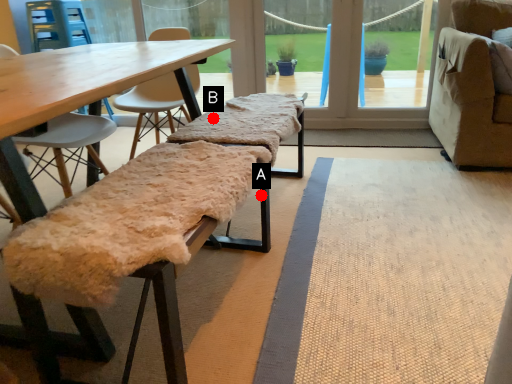
Question: Two points are circled on the image, labeled by A and B beside each circle. Which point is closer to the camera taking this photo?

Choices:
 (A) A is closer
 (B) B is closer

Answer: (A)